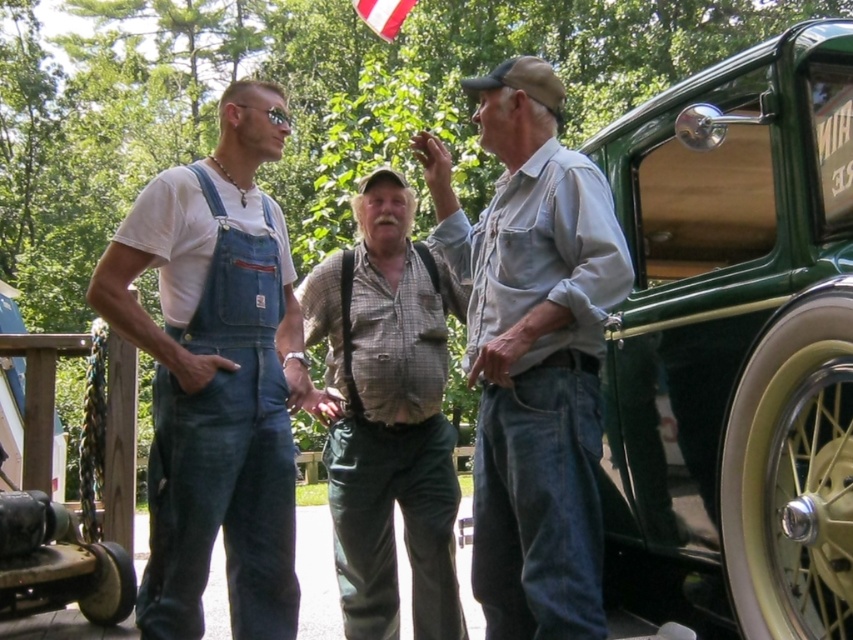
Image resolution: width=853 pixels, height=640 pixels. Describe the element at coordinates (734, 346) in the screenshot. I see `green polished wood door at right` at that location.

Does point (791, 93) come behind point (387, 8)?

No, it is not.

Which is behind, point (821, 628) or point (373, 13)?

The point (373, 13) is behind.

Image resolution: width=853 pixels, height=640 pixels. Find the location of `green polished wood door at right`. green polished wood door at right is located at coordinates (734, 346).

Between point (619, 348) and point (579, 289), which one is positioned in front?

Point (579, 289)

Consider the image. Is green polished wood door at right behind denim shirt at center?

That is False.

Does point (650, 184) come in front of point (560, 436)?

No, it is not.

Find the location of a particular element. green polished wood door at right is located at coordinates (734, 346).

Based on the photo, is checkered fabric shirt at center smaller than white fabric flag at upper center?

No.

Does checkered fabric shirt at center have a lesser width compared to white fabric flag at upper center?

Yes.

Identify the location of checkered fabric shirt at center. Image resolution: width=853 pixels, height=640 pixels. pos(387,416).

Find the location of `checkered fabric shirt at center`. checkered fabric shirt at center is located at coordinates (387, 416).